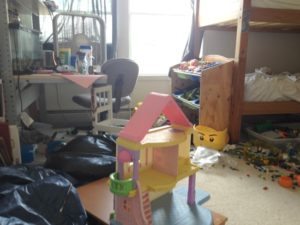
At what (x,y) coordinates should I click in order to perform the action: click on doll house. Please return your answer as a coordinate pair (x, y). Looking at the image, I should click on (148, 165).